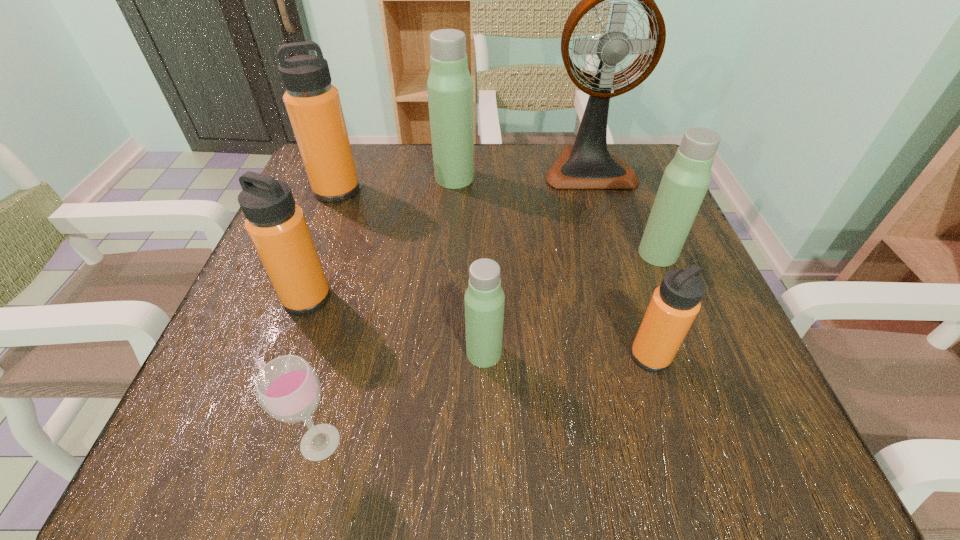
Where is `the fifth thermos bottle from left to right`? The width and height of the screenshot is (960, 540). the fifth thermos bottle from left to right is located at coordinates (674, 305).

I want to click on wineglass, so click(288, 388).

I want to click on the third object from left to right, so click(288, 388).

In order to click on vacant point located on the front-facing side of the fan in this screenshot , I will do `click(631, 306)`.

Locate an element on the screen. Image resolution: width=960 pixels, height=540 pixels. vacant space located on the front of the biggest orange thermos bottle is located at coordinates click(302, 280).

This screenshot has height=540, width=960. Find the location of `blank area located on the back of the farthest light thermos bottle`. blank area located on the back of the farthest light thermos bottle is located at coordinates (456, 150).

The width and height of the screenshot is (960, 540). Identify the location of vacant position located on the left of the second farthest light thermos bottle. (488, 254).

The height and width of the screenshot is (540, 960). What are the coordinates of `free space located 0.100m on the right of the fourth nearest object` in the screenshot? It's located at (390, 298).

I want to click on free space located on the left of the smallest light thermos bottle, so click(354, 353).

The width and height of the screenshot is (960, 540). What are the coordinates of `free space located on the back of the fifth thermos bottle from left to right` in the screenshot? It's located at [637, 315].